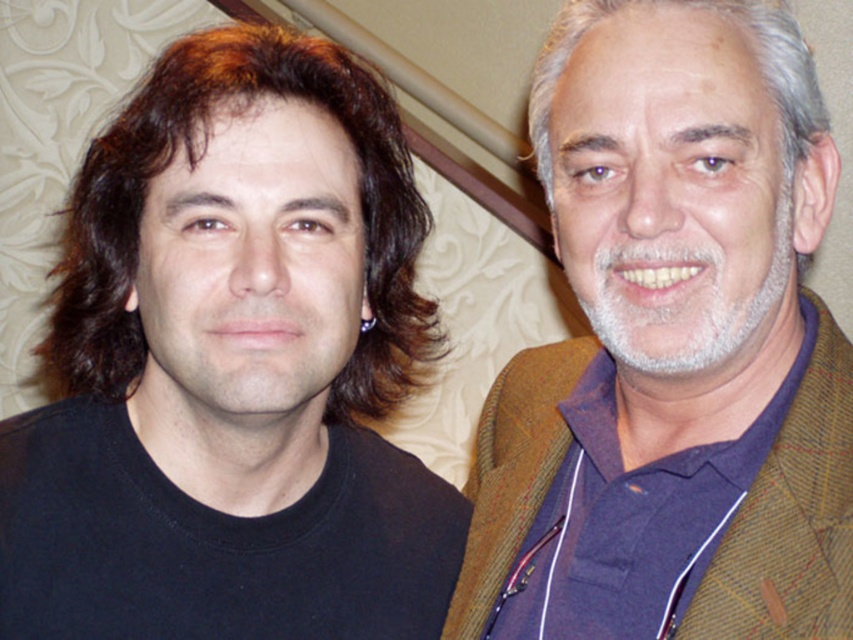
Question: Can you confirm if brown woolen jacket at right is smaller than brownshinyhair at left?

Choices:
 (A) yes
 (B) no

Answer: (A)

Question: Is brown woolen jacket at right smaller than brownshinyhair at left?

Choices:
 (A) no
 (B) yes

Answer: (B)

Question: Which of the following is the farthest from the observer?

Choices:
 (A) brown woolen jacket at right
 (B) brownshinyhair at left

Answer: (B)

Question: Is brown woolen jacket at right behind brownshinyhair at left?

Choices:
 (A) no
 (B) yes

Answer: (A)